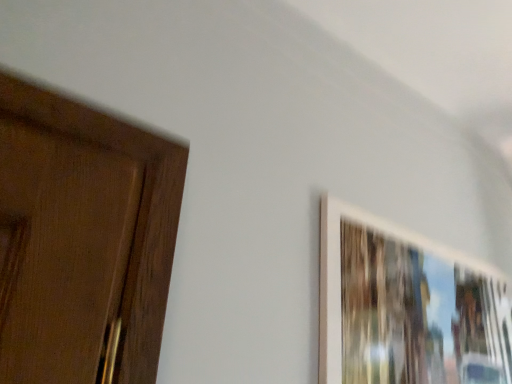
The image size is (512, 384). What do you see at coordinates (405, 307) in the screenshot?
I see `white matte picture frame at upper right` at bounding box center [405, 307].

This screenshot has width=512, height=384. I want to click on white matte picture frame at upper right, so click(405, 307).

In order to face white matte picture frame at upper right, should I rotate leftwards or rightwards?

Turn right approximately 24.457 degrees to face it.

This screenshot has height=384, width=512. Find the location of `white matte picture frame at upper right`. white matte picture frame at upper right is located at coordinates (405, 307).